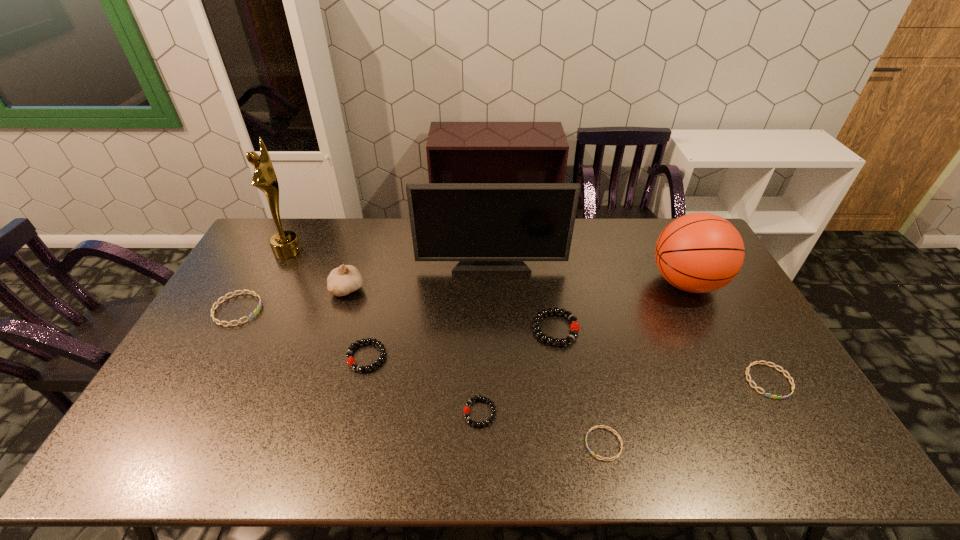
Where is `vacant space at the right edge of the desktop`? The height and width of the screenshot is (540, 960). vacant space at the right edge of the desktop is located at coordinates (760, 341).

Where is `vacant space at the far left corner of the desktop`? This screenshot has height=540, width=960. vacant space at the far left corner of the desktop is located at coordinates (300, 220).

This screenshot has height=540, width=960. In order to click on vacant space at the far right corner in this screenshot , I will do `click(673, 220)`.

The width and height of the screenshot is (960, 540). Identify the location of vacant space in between the third object from left to right and the rightmost black bracelet. (451, 309).

At what (x,y) coordinates should I click in order to perform the action: click on blank region between the tallest object and the nearest black bracelet. Please return your answer as a coordinate pair (x, y). The height and width of the screenshot is (540, 960). Looking at the image, I should click on (384, 332).

This screenshot has width=960, height=540. I want to click on vacant region between the nearest black bracelet and the second tallest object, so click(x=486, y=339).

Locate an element on the screen. This screenshot has height=540, width=960. empty space that is in between the smallest blue bracelet and the second black bracelet from left to right is located at coordinates (541, 428).

Locate an element on the screen. The width and height of the screenshot is (960, 540). vacant area between the award and the biggest black bracelet is located at coordinates (421, 289).

Find the location of a particular element. The image size is (960, 540). free space between the garlic and the rightmost blue bracelet is located at coordinates (558, 335).

Find the location of a particular element. This screenshot has width=960, height=540. free area in between the rightmost blue bracelet and the second black bracelet from left to right is located at coordinates (624, 397).